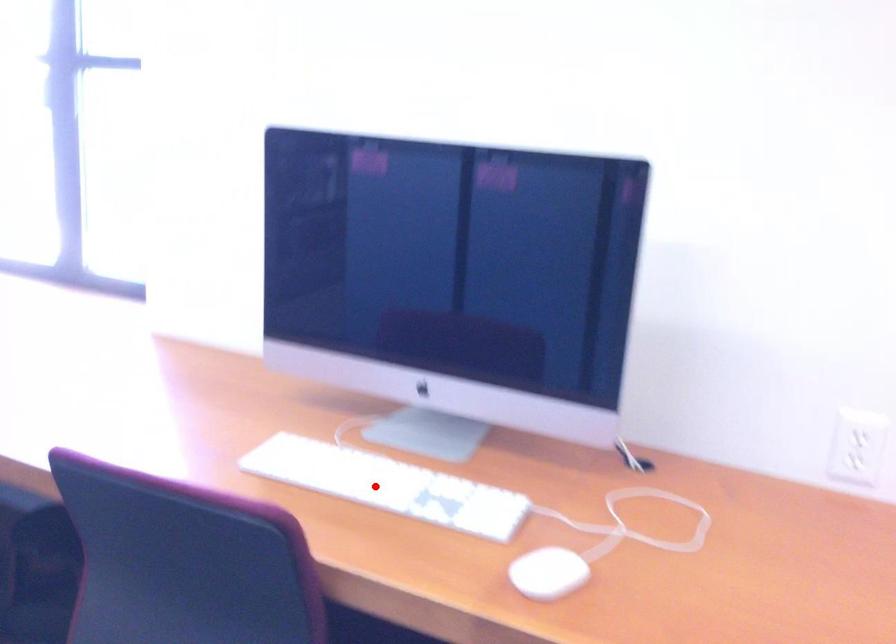
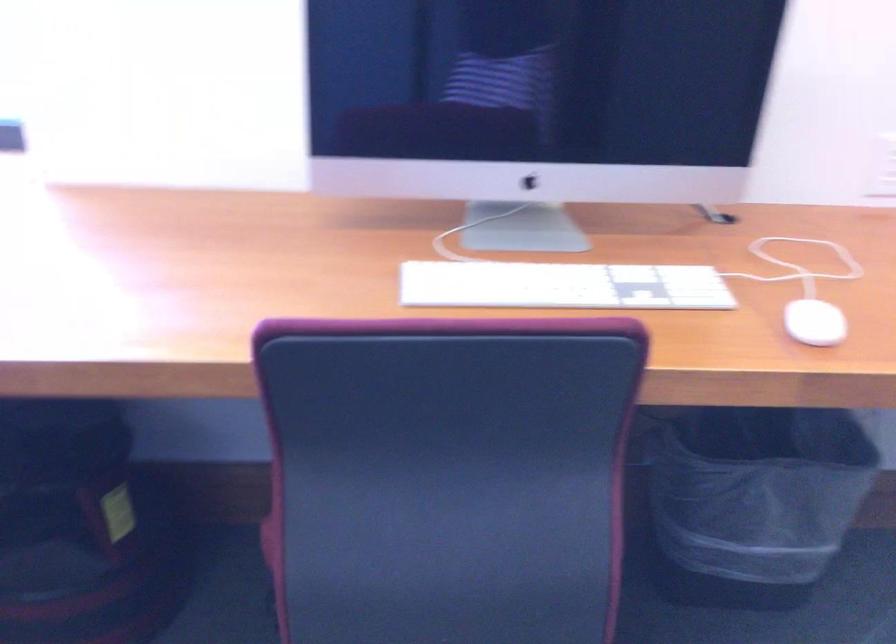
The point at the highlighted location is marked in the first image. Where is the corresponding point in the second image?

(562, 285)